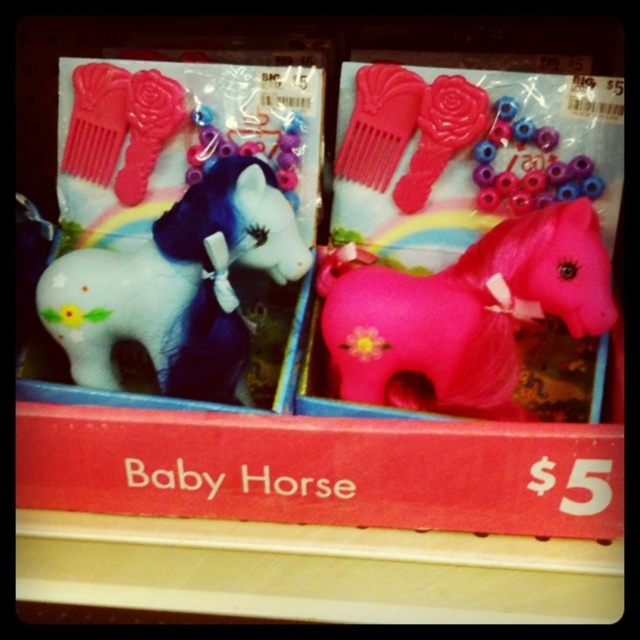
Which is more to the left, pink matte horse at center or white matte horse at left?

From the viewer's perspective, white matte horse at left appears more on the left side.

Between point (458, 328) and point (284, 260), which one is positioned behind?

The point (284, 260) is behind.

At what (x,y) coordinates should I click in order to perform the action: click on pink matte horse at center. Please return your answer as a coordinate pair (x, y). Looking at the image, I should click on (464, 314).